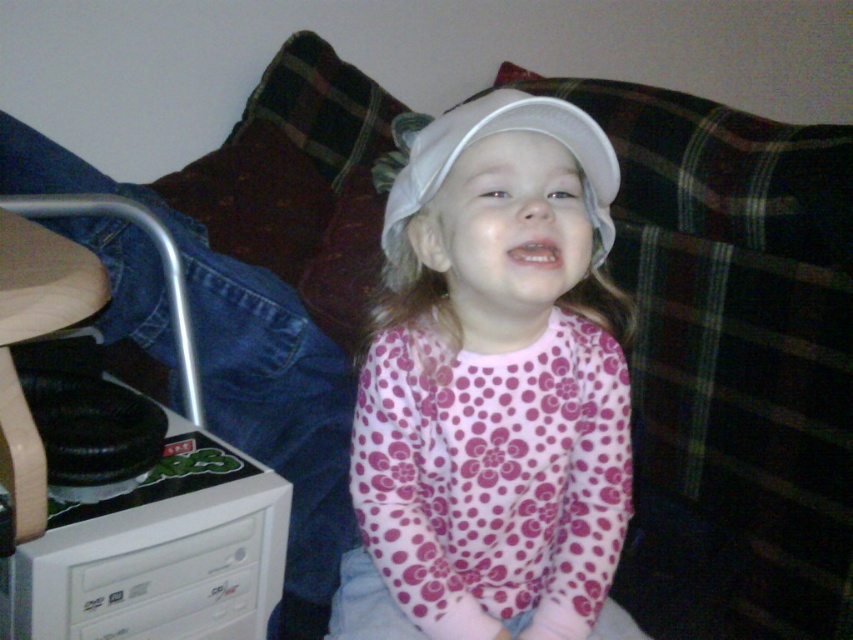
You are standing in the room and want to reach a point that is exactly 80 centimeters away from you. Is the point at coordinates point (579, 179) within this distance?

The distance of point (579, 179) from viewer is 81.22 centimeters, which is slightly more than 80 centimeters. Therefore, the point is just outside the desired distance.

You are designing a display case for a toy store. The case has two compartments side by side. The left compartment is 10 cm wide, and the right compartment is 12 cm wide. You need to place the white matte cap at center and the white matte baseball hat at center into the case. Based on their sizes, which object should go into which compartment?

The white matte cap at center is wider than the white matte baseball hat at center. Therefore, the white matte cap at center should go into the right compartment which is 12 cm wide, and the white matte baseball hat at center should go into the left compartment which is 10 cm wide.